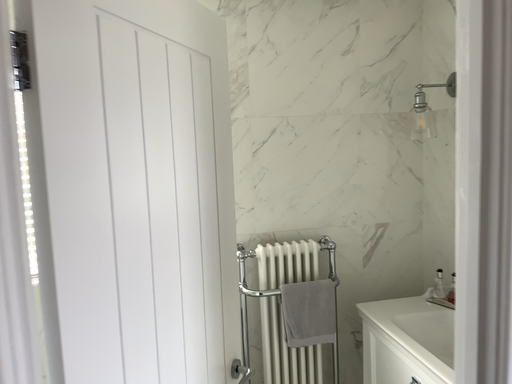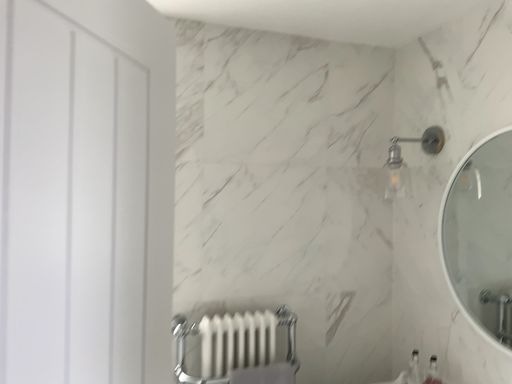
Question: How did the camera likely rotate when shooting the video?

Choices:
 (A) rotated right
 (B) rotated left

Answer: (A)